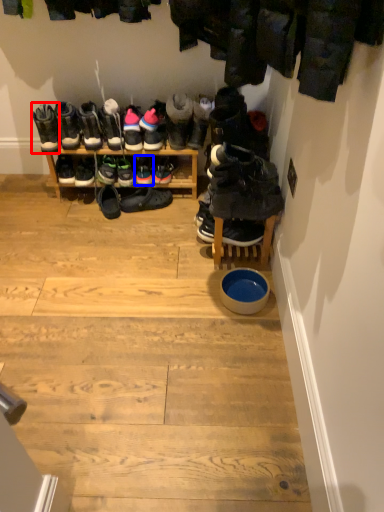
Question: Which object appears farthest to the camera in this image, footwear (highlighted by a red box) or footwear (highlighted by a blue box)?

Choices:
 (A) footwear
 (B) footwear

Answer: (B)